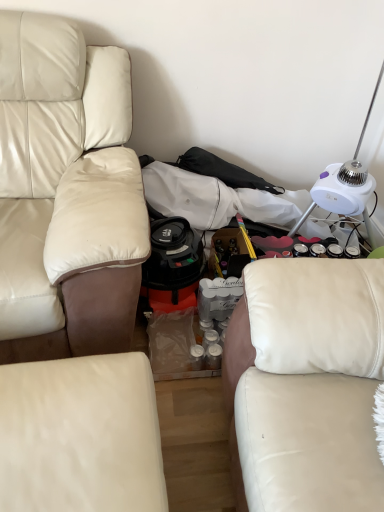
Question: Can you confirm if white leather studio couch at lower center, which appears as the second studio couch when viewed from the right, is smaller than white plastic table lamp at upper right?

Choices:
 (A) yes
 (B) no

Answer: (B)

Question: Is white leather studio couch at lower center, which appears as the second studio couch when viewed from the right, behind white plastic table lamp at upper right?

Choices:
 (A) yes
 (B) no

Answer: (B)

Question: From the image's perspective, is white leather studio couch at lower center, which appears as the second studio couch when viewed from the right, on top of white plastic table lamp at upper right?

Choices:
 (A) no
 (B) yes

Answer: (A)

Question: Is white leather studio couch at lower center, which appears as the second studio couch when viewed from the right, taller than white plastic table lamp at upper right?

Choices:
 (A) yes
 (B) no

Answer: (B)

Question: Is white leather studio couch at lower center, arranged as the 2th studio couch when viewed from the left, at the right side of white plastic table lamp at upper right?

Choices:
 (A) no
 (B) yes

Answer: (A)

Question: From a real-world perspective, is white leather studio couch at lower center, which appears as the second studio couch when viewed from the right, below white plastic table lamp at upper right?

Choices:
 (A) yes
 (B) no

Answer: (A)

Question: From the image's perspective, does white plastic table lamp at upper right appear lower than beige leather couch at left, acting as the first studio couch starting from the left?

Choices:
 (A) yes
 (B) no

Answer: (B)

Question: Considering the relative sizes of white plastic table lamp at upper right and beige leather couch at left, acting as the first studio couch starting from the left, in the image provided, is white plastic table lamp at upper right smaller than beige leather couch at left, acting as the first studio couch starting from the left,?

Choices:
 (A) no
 (B) yes

Answer: (B)

Question: Does white plastic table lamp at upper right have a lesser width compared to beige leather couch at left, which appears as the 3th studio couch when viewed from the right?

Choices:
 (A) no
 (B) yes

Answer: (B)

Question: Is white plastic table lamp at upper right at the left side of beige leather couch at left, acting as the first studio couch starting from the left?

Choices:
 (A) yes
 (B) no

Answer: (B)

Question: Does white plastic table lamp at upper right have a greater width compared to beige leather couch at left, acting as the first studio couch starting from the left?

Choices:
 (A) no
 (B) yes

Answer: (A)

Question: Is there a large distance between white plastic table lamp at upper right and beige leather couch at left, acting as the first studio couch starting from the left?

Choices:
 (A) yes
 (B) no

Answer: (B)

Question: Is beige leather couch at left, acting as the first studio couch starting from the left, further to the viewer compared to white leather studio couch at right, the first studio couch when ordered from right to left?

Choices:
 (A) yes
 (B) no

Answer: (A)